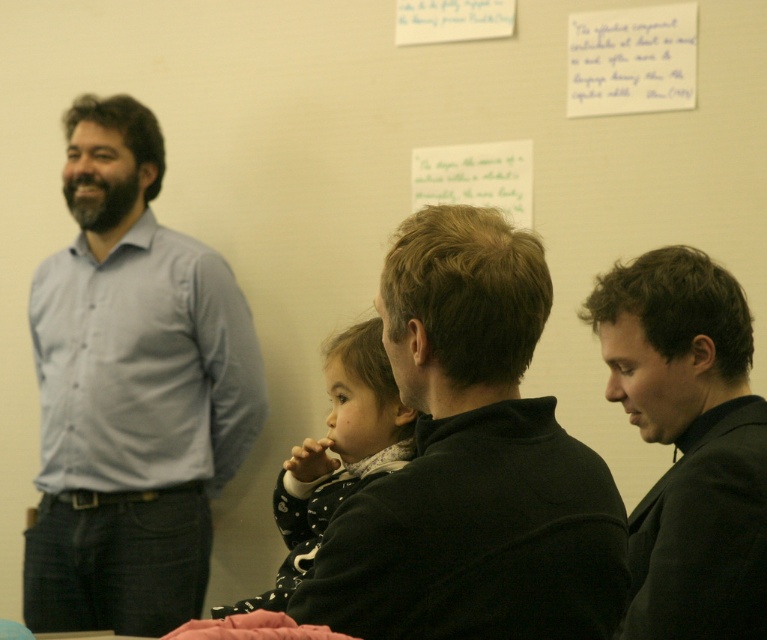
You are a photographer trying to capture a group photo of the light blue shirt at left and the black matte jacket at right. Since you want to ensure both subjects are in focus, you need to adjust the camera settings based on their heights. Which subject should you focus on to ensure proper depth of field?

The light blue shirt at left is much taller than the black matte jacket at right. To ensure proper depth of field, you should focus on the light blue shirt at left since it is taller and likely further away from the camera.

You are a photographer adjusting your camera settings to capture a group photo. You notice the black fleece at center and the white dotted coat at center are quite close. What is the minimum distance your camera lens should be able to focus on to ensure both are in sharp focus?

The black fleece at center is 62.61 centimeters away from the white dotted coat at center. To ensure both are in sharp focus, the camera lens should have a minimum focusing distance less than 62.61 centimeters.